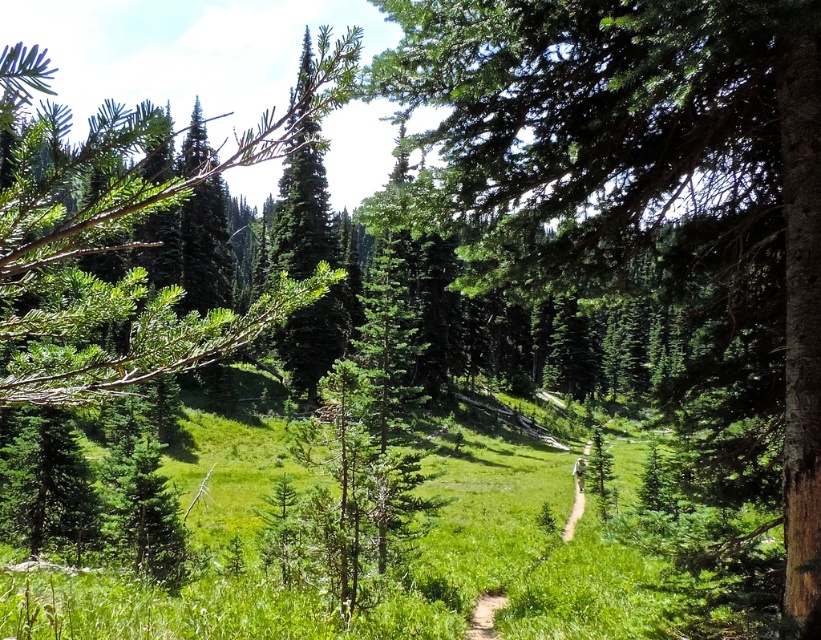
Question: Can you confirm if green textured tree at center is positioned above green needle-like leaves at center?

Choices:
 (A) yes
 (B) no

Answer: (B)

Question: Among these objects, which one is farthest from the camera?

Choices:
 (A) green textured tree at center
 (B) green needle-like leaves at center

Answer: (A)

Question: Which of the following is the closest to the observer?

Choices:
 (A) (611, 115)
 (B) (15, 246)

Answer: (B)

Question: Is green textured tree at center below green needle-like leaves at center?

Choices:
 (A) no
 (B) yes

Answer: (B)

Question: Considering the relative positions of green textured tree at center and green needle-like leaves at center in the image provided, where is green textured tree at center located with respect to green needle-like leaves at center?

Choices:
 (A) above
 (B) below

Answer: (B)